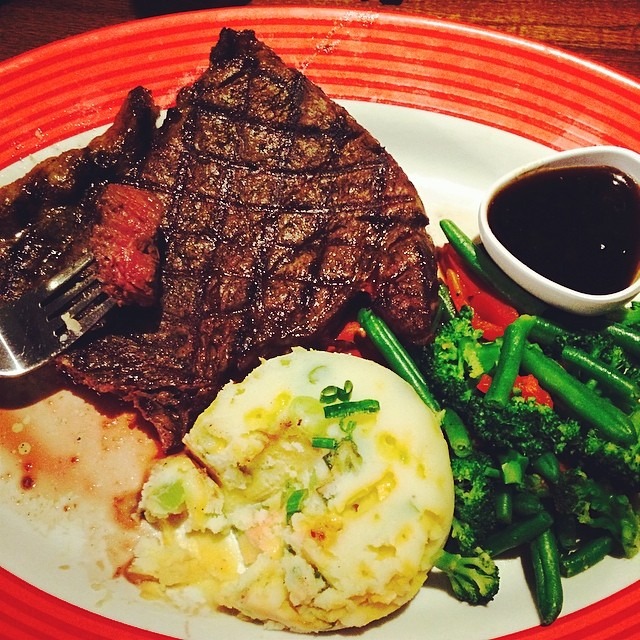
Where is `plate edge`? plate edge is located at coordinates (374, 34), (124, 630), (589, 628).